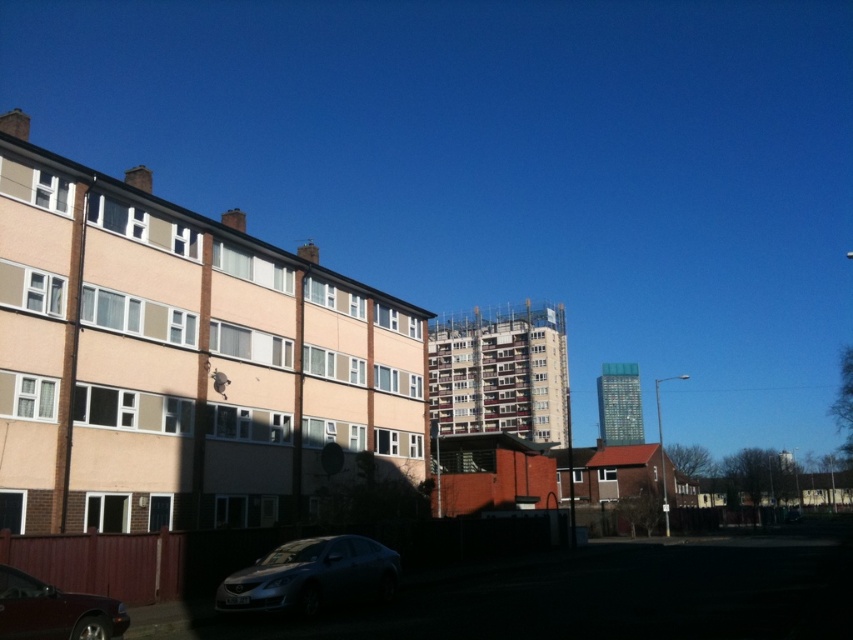
Can you confirm if satin silver sedan at lower center is positioned below shiny dark red car at lower left?

Yes.

Does satin silver sedan at lower center appear on the left side of shiny dark red car at lower left?

No, satin silver sedan at lower center is not to the left of shiny dark red car at lower left.

Which is in front, point (316, 564) or point (123, 625)?

Point (123, 625)

In order to click on satin silver sedan at lower center in this screenshot , I will do `click(311, 577)`.